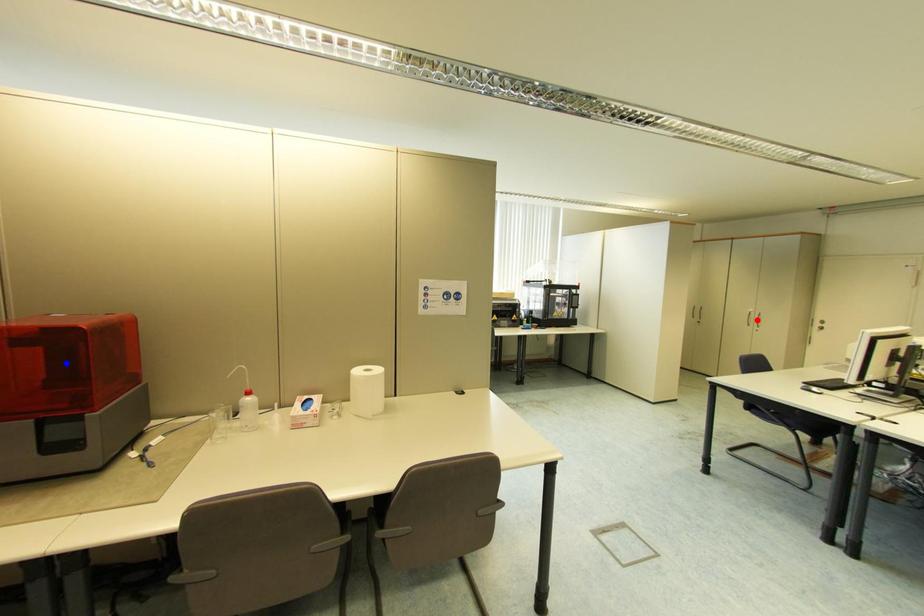
Question: Two points are marked on the image. Which point is closer to the camera?

Choices:
 (A) Blue point is closer.
 (B) Red point is closer.

Answer: (A)